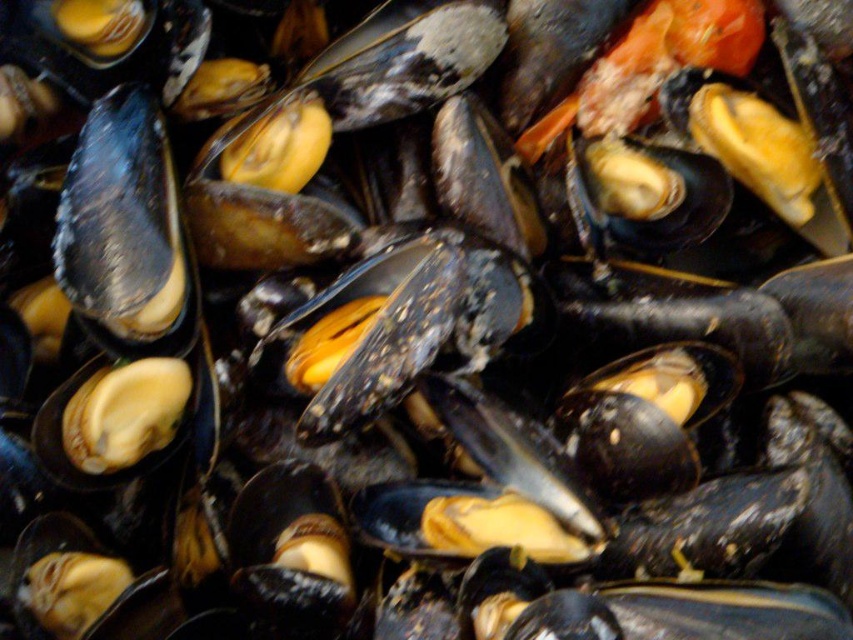
Does matte black mussel at upper left have a greater width compared to matte yellow shell at center?

Correct, the width of matte black mussel at upper left exceeds that of matte yellow shell at center.

Between point (119, 307) and point (144, 385), which one is positioned behind?

Point (144, 385)

Locate an element on the screen. The height and width of the screenshot is (640, 853). matte black mussel at upper left is located at coordinates (120, 220).